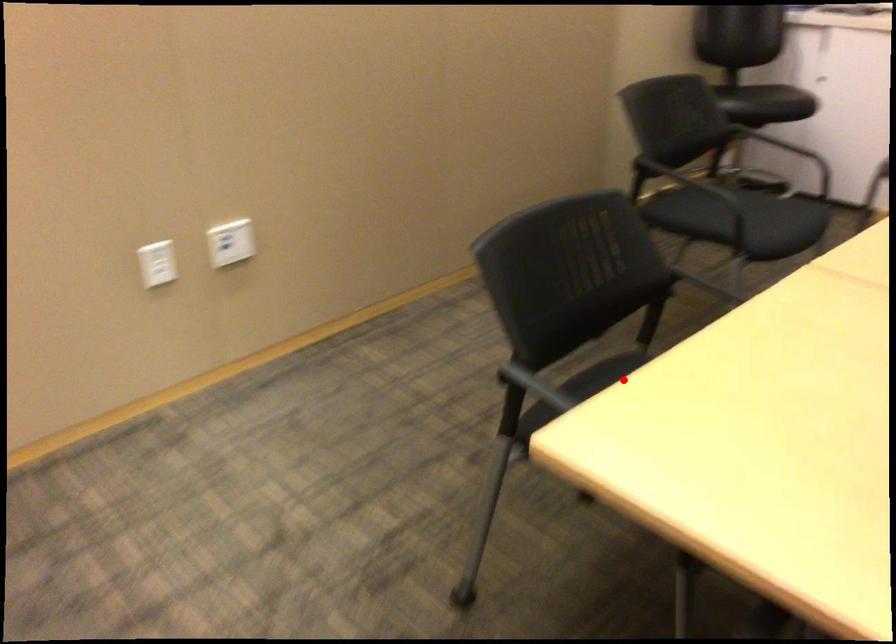
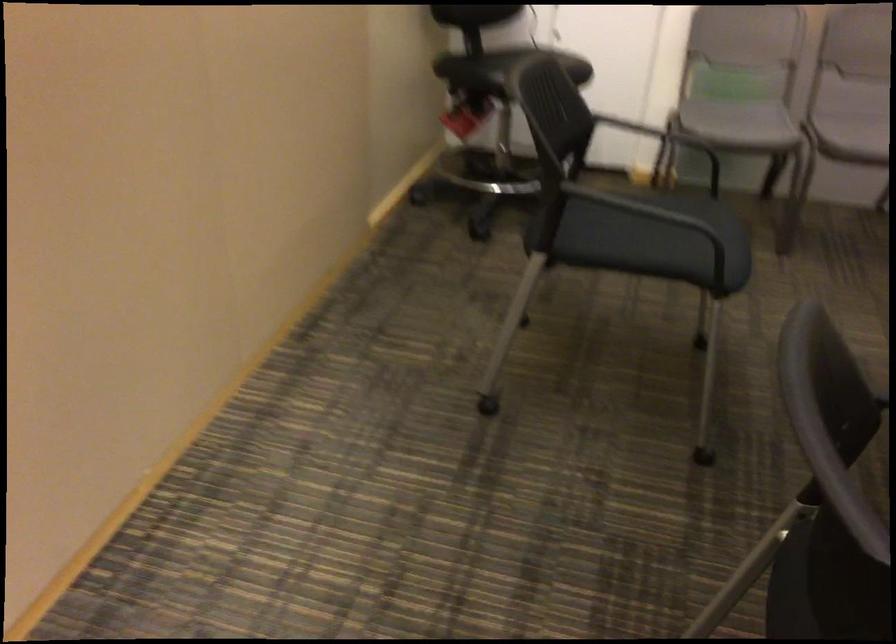
Find the pixel in the second image that matches the highlighted location in the first image.

(826, 585)